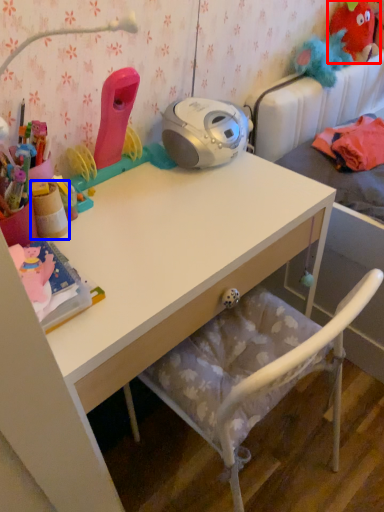
Question: Which object is closer to the camera taking this photo, toy (highlighted by a red box) or stationery (highlighted by a blue box)?

Choices:
 (A) toy
 (B) stationery

Answer: (B)